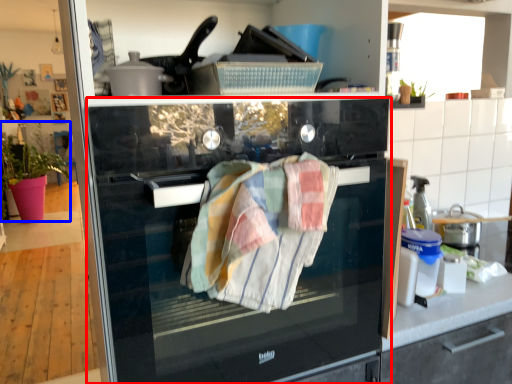
Question: Which point is closer to the camera, home appliance (highlighted by a red box) or plant (highlighted by a blue box)?

Choices:
 (A) home appliance
 (B) plant

Answer: (A)